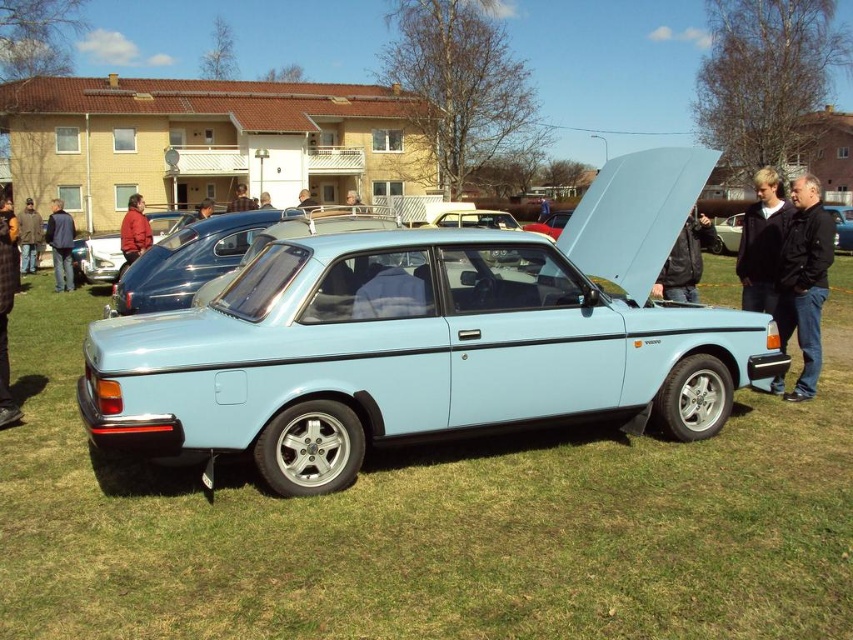
Who is more forward, (428,444) or (9,284)?

Positioned in front is point (428,444).

Does green grass at center have a greater height compared to denim jacket at lower left?

Indeed, green grass at center has a greater height compared to denim jacket at lower left.

Locate an element on the screen. green grass at center is located at coordinates (433, 524).

The image size is (853, 640). In order to click on green grass at center in this screenshot , I will do `click(433, 524)`.

Does metallic blue car at center have a larger size compared to dark brown leather jacket at center?

Actually, metallic blue car at center might be smaller than dark brown leather jacket at center.

Based on the photo, who is taller, metallic blue car at center or dark brown leather jacket at center?

With more height is dark brown leather jacket at center.

Does point (100, 241) come closer to viewer compared to point (206, 200)?

Yes, point (100, 241) is in front of point (206, 200).

Locate an element on the screen. metallic blue car at center is located at coordinates (102, 259).

Is black leather jacket at right shorter than blue fabric jacket at center?

Correct, black leather jacket at right is not as tall as blue fabric jacket at center.

Does black leather jacket at right appear over blue fabric jacket at center?

No, black leather jacket at right is not above blue fabric jacket at center.

Locate an element on the screen. The image size is (853, 640). black leather jacket at right is located at coordinates (804, 280).